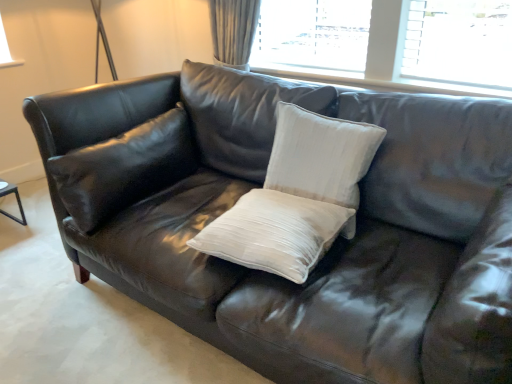
Question: Can you confirm if matte black pillow at left, positioned as the first pillow in left-to-right order, is wider than white textured pillow at center, which ranks as the 3th pillow in left-to-right order?

Choices:
 (A) no
 (B) yes

Answer: (B)

Question: From a real-world perspective, is matte black pillow at left, placed as the 3th pillow when sorted from right to left, on white textured pillow at center, the 1th pillow positioned from the right?

Choices:
 (A) no
 (B) yes

Answer: (A)

Question: From the image's perspective, does matte black pillow at left, positioned as the first pillow in left-to-right order, appear lower than white textured pillow at center, which ranks as the 3th pillow in left-to-right order?

Choices:
 (A) no
 (B) yes

Answer: (A)

Question: Could you tell me if matte black pillow at left, placed as the 3th pillow when sorted from right to left, is turned towards white textured pillow at center, which ranks as the 3th pillow in left-to-right order?

Choices:
 (A) yes
 (B) no

Answer: (A)

Question: Is matte black pillow at left, placed as the 3th pillow when sorted from right to left, bigger than white textured pillow at center, which ranks as the 3th pillow in left-to-right order?

Choices:
 (A) no
 (B) yes

Answer: (B)

Question: From a real-world perspective, is white satin pillow at center, the 2th pillow positioned from the right, physically located above or below white textured pillow at center, which ranks as the 3th pillow in left-to-right order?

Choices:
 (A) above
 (B) below

Answer: (B)

Question: Is white satin pillow at center, the second pillow from the left, to the left or to the right of white textured pillow at center, the 1th pillow positioned from the right, in the image?

Choices:
 (A) right
 (B) left

Answer: (B)

Question: Is white satin pillow at center, the 2th pillow positioned from the right, taller or shorter than white textured pillow at center, which ranks as the 3th pillow in left-to-right order?

Choices:
 (A) short
 (B) tall

Answer: (A)

Question: From the image's perspective, is white satin pillow at center, the second pillow from the left, above or below white textured pillow at center, the 1th pillow positioned from the right?

Choices:
 (A) below
 (B) above

Answer: (A)

Question: Based on their sizes in the image, would you say white satin pillow at center, the 2th pillow positioned from the right, is bigger or smaller than matte black pillow at left, placed as the 3th pillow when sorted from right to left?

Choices:
 (A) small
 (B) big

Answer: (A)

Question: From their relative heights in the image, would you say white satin pillow at center, the 2th pillow positioned from the right, is taller or shorter than matte black pillow at left, positioned as the first pillow in left-to-right order?

Choices:
 (A) short
 (B) tall

Answer: (A)

Question: Which is correct: white satin pillow at center, the 2th pillow positioned from the right, is inside matte black pillow at left, placed as the 3th pillow when sorted from right to left, or outside of it?

Choices:
 (A) inside
 (B) outside

Answer: (B)

Question: Is white satin pillow at center, the second pillow from the left, to the left or to the right of matte black pillow at left, placed as the 3th pillow when sorted from right to left, in the image?

Choices:
 (A) left
 (B) right

Answer: (B)

Question: From the image's perspective, is white textured pillow at center, which ranks as the 3th pillow in left-to-right order, located above or below matte black pillow at left, positioned as the first pillow in left-to-right order?

Choices:
 (A) below
 (B) above

Answer: (A)

Question: Is white textured pillow at center, which ranks as the 3th pillow in left-to-right order, wider or thinner than matte black pillow at left, positioned as the first pillow in left-to-right order?

Choices:
 (A) wide
 (B) thin

Answer: (B)